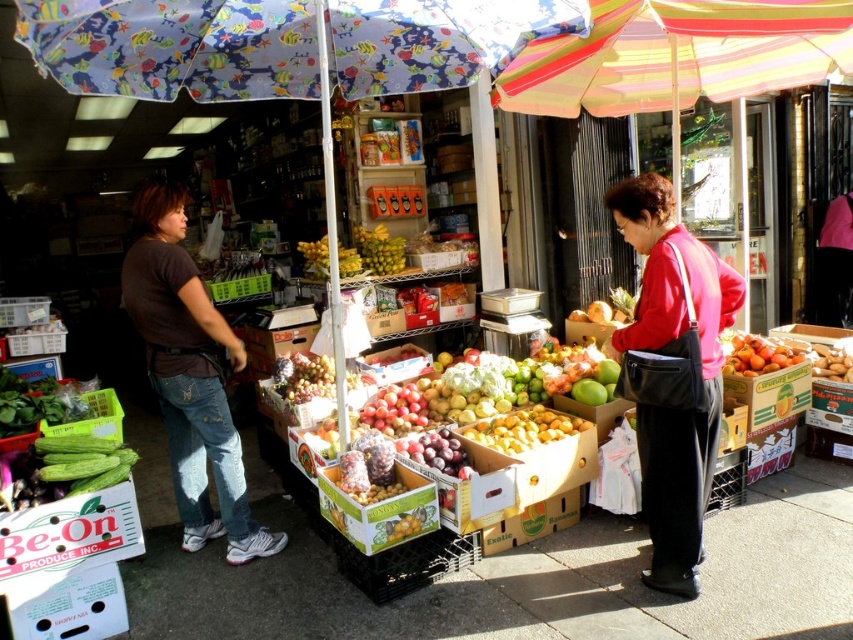
Which is behind, point (491, 435) or point (450, 464)?

Point (491, 435)

Which of these two, yellow matte plums at center or shiny purple plums at center, stands taller?

With more height is shiny purple plums at center.

Describe the element at coordinates (524, 429) in the screenshot. I see `yellow matte plums at center` at that location.

The image size is (853, 640). I want to click on yellow matte plums at center, so click(x=524, y=429).

Between ripe red tomatoes at center and yellow matte bananas at center, which one appears on the right side from the viewer's perspective?

Positioned to the right is ripe red tomatoes at center.

Is ripe red tomatoes at center positioned in front of yellow matte bananas at center?

Yes, ripe red tomatoes at center is in front of yellow matte bananas at center.

Is point (758, 356) in front of point (325, 240)?

Yes, it is in front of point (325, 240).

Image resolution: width=853 pixels, height=640 pixels. In order to click on ripe red tomatoes at center in this screenshot , I will do `click(757, 353)`.

Does matte red sweater at center appear over brown cotton shirt at left?

Yes.

Between point (647, 476) and point (215, 428), which one is positioned behind?

The point (215, 428) is behind.

At what (x,y) coordinates should I click in order to perform the action: click on matte red sweater at center. Please return your answer as a coordinate pair (x, y). Looking at the image, I should click on 672,372.